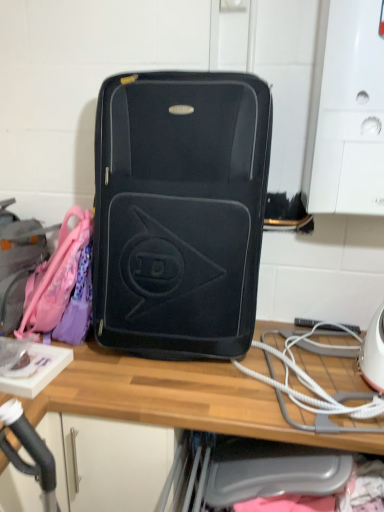
Where is `wooden desk at center`? This screenshot has height=512, width=384. wooden desk at center is located at coordinates (152, 394).

Describe the element at coordinates (179, 212) in the screenshot. I see `matte black suitcase at center` at that location.

Image resolution: width=384 pixels, height=512 pixels. What are the coordinates of `white cord at lower right` in the screenshot? It's located at click(313, 387).

Where is `wooden desk at center`? wooden desk at center is located at coordinates (152, 394).

Is white cord at lower right inside the boundaries of matte pink backpack at left, or outside?

The correct answer is: outside.

Is white cord at lower right taller than matte pink backpack at left?

Incorrect, the height of white cord at lower right is not larger of that of matte pink backpack at left.

Consider the image. Is white cord at lower right positioned with its back to matte pink backpack at left?

No, white cord at lower right's orientation is not away from matte pink backpack at left.

Looking at this image, in the image, is white cord at lower right on the left side or the right side of matte pink backpack at left?

Based on their positions, white cord at lower right is located to the right of matte pink backpack at left.

Considering their positions, is wooden desk at center located in front of or behind matte pink backpack at left?

wooden desk at center is positioned closer to the viewer than matte pink backpack at left.

Is wooden desk at center not near matte pink backpack at left?

That's not correct — wooden desk at center is a little close to matte pink backpack at left.

From the image's perspective, is wooden desk at center above or below matte pink backpack at left?

From the image's perspective, wooden desk at center appears below matte pink backpack at left.

Which is closer, (254,382) or (3,220)?

Point (254,382) is positioned closer to the camera compared to point (3,220).

Is wooden desk at center wider or thinner than white cord at lower right?

wooden desk at center is wider than white cord at lower right.

In the image, there is a wooden desk at center. Where is `rope above it (from the image's perspective)`? rope above it (from the image's perspective) is located at coordinates (313, 387).

Is wooden desk at center looking in the opposite direction of white cord at lower right?

No, wooden desk at center is not facing the opposite direction of white cord at lower right.

In the scene shown: Which object is positioned more to the left, wooden desk at center or white cord at lower right?

From the viewer's perspective, wooden desk at center appears more on the left side.

Which object is closer to the camera, matte black suitcase at center or white cord at lower right?

Positioned in front is matte black suitcase at center.

Would you say matte black suitcase at center is inside or outside white cord at lower right?

matte black suitcase at center is not inside white cord at lower right, it's outside.

Are matte black suitcase at center and white cord at lower right far apart?

No, matte black suitcase at center is not far away from white cord at lower right.

From the image's perspective, is matte black suitcase at center over white cord at lower right?

Yes, from the image's perspective, matte black suitcase at center is on top of white cord at lower right.

In order to click on luggage located on the left of matte black suitcase at center in this screenshot , I will do `click(17, 264)`.

Could you tell me if matte pink backpack at left is turned towards matte black suitcase at center?

No, matte pink backpack at left is not facing towards matte black suitcase at center.

Is matte pink backpack at left at the right side of matte black suitcase at center?

In fact, matte pink backpack at left is to the left of matte black suitcase at center.

The height and width of the screenshot is (512, 384). Find the location of `desk in front of the matte pink backpack at left`. desk in front of the matte pink backpack at left is located at coordinates (152, 394).

Would you consider matte pink backpack at left to be distant from wooden desk at center?

They are positioned close to each other.

Would you say matte pink backpack at left is outside wooden desk at center?

matte pink backpack at left is positioned outside wooden desk at center.

From the image's perspective, which is above, matte pink backpack at left or wooden desk at center?

From the image's view, matte pink backpack at left is above.

Which object is further away from the camera, white cord at lower right or wooden desk at center?

white cord at lower right is further from the camera.

Is white cord at lower right not near wooden desk at center?

No, white cord at lower right is not far from wooden desk at center.

From the image's perspective, does white cord at lower right appear higher than wooden desk at center?

Yes, from the image's perspective, white cord at lower right is over wooden desk at center.

At what (x,y) coordinates should I click in order to perform the action: click on rope directly beneath the matte pink backpack at left (from a real-world perspective). Please return your answer as a coordinate pair (x, y). The image size is (384, 512). Looking at the image, I should click on (313, 387).

At what (x,y) coordinates should I click in order to perform the action: click on luggage on the left of wooden desk at center. Please return your answer as a coordinate pair (x, y). The width and height of the screenshot is (384, 512). Looking at the image, I should click on (17, 264).

Estimate the real-world distances between objects in this image. Which object is further from matte black suitcase at center, wooden desk at center or white cord at lower right?

Based on the image, white cord at lower right appears to be further to matte black suitcase at center.

From the image, which object appears to be farther from matte black suitcase at center, white cord at lower right or wooden desk at center?

white cord at lower right lies further to matte black suitcase at center than the other object.

In the scene shown: Which object lies further to the anchor point matte black suitcase at center, wooden desk at center or matte pink backpack at left?

matte pink backpack at left.

Looking at the image, which one is located further to white cord at lower right, matte pink backpack at left or matte black suitcase at center?

matte pink backpack at left is positioned further to the anchor white cord at lower right.

From the image, which object appears to be nearer to wooden desk at center, white cord at lower right or matte pink backpack at left?

The object closer to wooden desk at center is white cord at lower right.

Which object lies further to the anchor point wooden desk at center, white cord at lower right or matte black suitcase at center?

Among the two, matte black suitcase at center is located further to wooden desk at center.

From the image, which object appears to be farther from wooden desk at center, matte black suitcase at center or matte pink backpack at left?

matte pink backpack at left is further to wooden desk at center.

Estimate the real-world distances between objects in this image. Which object is closer to matte black suitcase at center, white cord at lower right or matte pink backpack at left?

white cord at lower right is closer to matte black suitcase at center.

Identify the location of luggage that lies between matte black suitcase at center and wooden desk at center from top to bottom. Image resolution: width=384 pixels, height=512 pixels. (17, 264).

In order to click on luggage and bags between matte pink backpack at left and white cord at lower right in the horizontal direction in this screenshot , I will do `click(179, 212)`.

Identify the location of rope between matte black suitcase at center and wooden desk at center vertically. The height and width of the screenshot is (512, 384). (x=313, y=387).

Where is `desk located between matte pink backpack at left and white cord at lower right in the left-right direction`? This screenshot has height=512, width=384. desk located between matte pink backpack at left and white cord at lower right in the left-right direction is located at coordinates (152, 394).